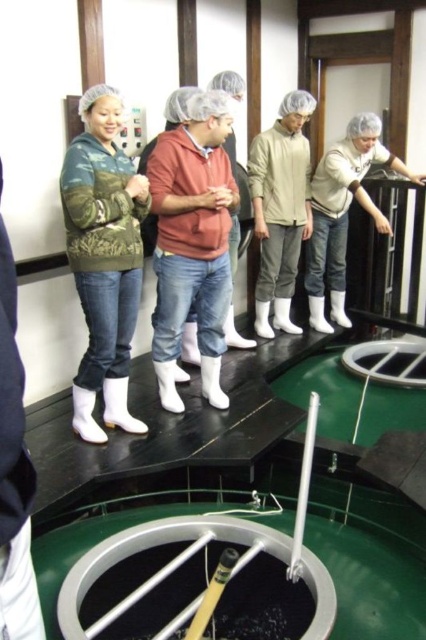
Question: Where is matte beige jacket at center located in relation to white matte jacket at upper center in the image?

Choices:
 (A) below
 (B) above

Answer: (B)

Question: Does camo-patterned jacket at left have a smaller size compared to matte beige jacket at center?

Choices:
 (A) yes
 (B) no

Answer: (A)

Question: Which point is farther to the camera?

Choices:
 (A) camo-patterned jacket at left
 (B) white matte jacket at upper center
 (C) matte beige jacket at center

Answer: (B)

Question: Estimate the real-world distances between objects in this image. Which object is farther from the camo-patterned jacket at left?

Choices:
 (A) white matte jacket at upper center
 (B) matte beige jacket at center

Answer: (A)

Question: Can you confirm if camo-patterned jacket at left is positioned to the right of white matte jacket at upper center?

Choices:
 (A) yes
 (B) no

Answer: (B)

Question: Which object is farther from the camera taking this photo?

Choices:
 (A) camo-patterned jacket at left
 (B) matte beige jacket at center
 (C) white matte jacket at upper center

Answer: (C)